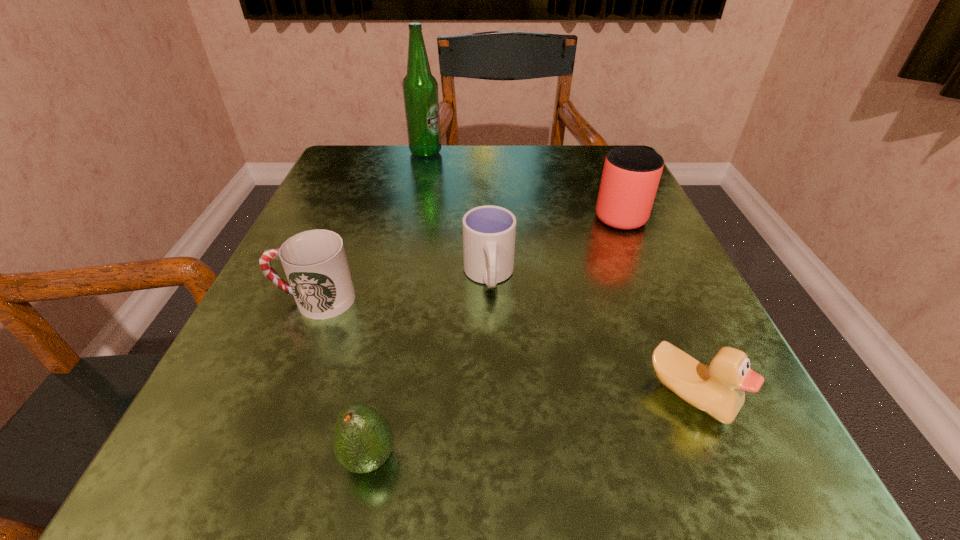
What are the coordinates of `free space located on the handle side of the farthest cup` in the screenshot? It's located at (594, 158).

Locate an element on the screen. free space located on the handle side of the farthest cup is located at coordinates (605, 181).

Find the location of a particular element. free space located 0.130m with the handle on the side of the second cup from left to right is located at coordinates (491, 374).

The width and height of the screenshot is (960, 540). Identify the location of free space located 0.090m at the beak of the duck. (742, 517).

Identify the location of free space located on the back of the nearest object. (402, 293).

Find the location of a particular element. The width and height of the screenshot is (960, 540). beer bottle at the far edge is located at coordinates (420, 89).

Find the location of a particular element. This screenshot has height=540, width=960. cup that is positioned at the far edge is located at coordinates click(631, 174).

The height and width of the screenshot is (540, 960). Find the location of `object at the near edge`. object at the near edge is located at coordinates (363, 440).

This screenshot has width=960, height=540. What are the coordinates of `object located at the left edge` in the screenshot? It's located at (315, 263).

Where is `cup situated at the right edge`? The image size is (960, 540). cup situated at the right edge is located at coordinates pos(631,174).